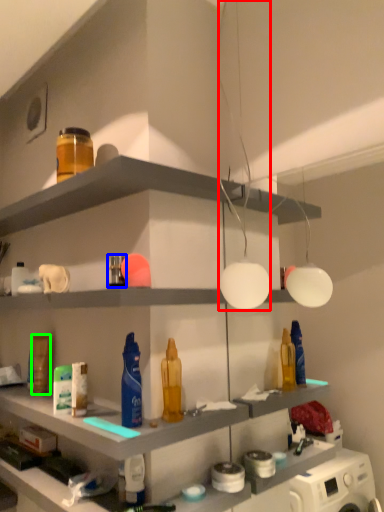
Question: Estimate the real-world distances between objects in this image. Which object is farther from light fixture (highlighted by a red box), toiletry (highlighted by a blue box) or toiletry (highlighted by a green box)?

Choices:
 (A) toiletry
 (B) toiletry

Answer: (B)